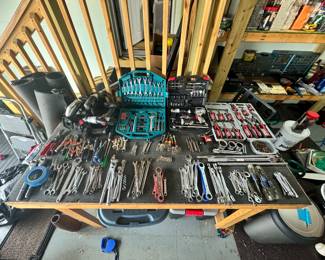
Find the location of a particular element. The height and width of the screenshot is (260, 325). shelves is located at coordinates (274, 38), (270, 95).